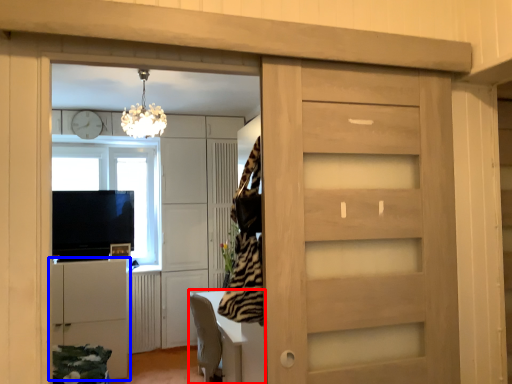
Question: Which of the following is the closest to the observer, table (highlighted by a red box) or cabinetry (highlighted by a blue box)?

Choices:
 (A) table
 (B) cabinetry

Answer: (A)